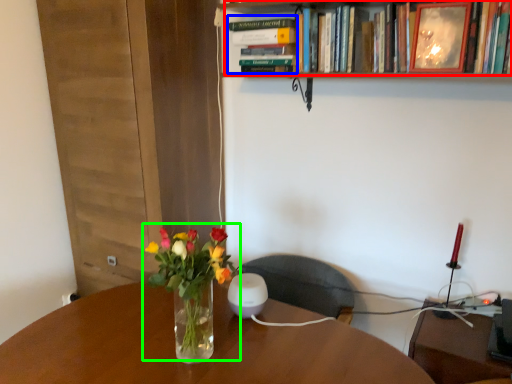
Question: Estimate the real-world distances between objects in this image. Which object is closer to book (highlighted by a red box), book (highlighted by a blue box) or floral arrangement (highlighted by a green box)?

Choices:
 (A) book
 (B) floral arrangement

Answer: (A)